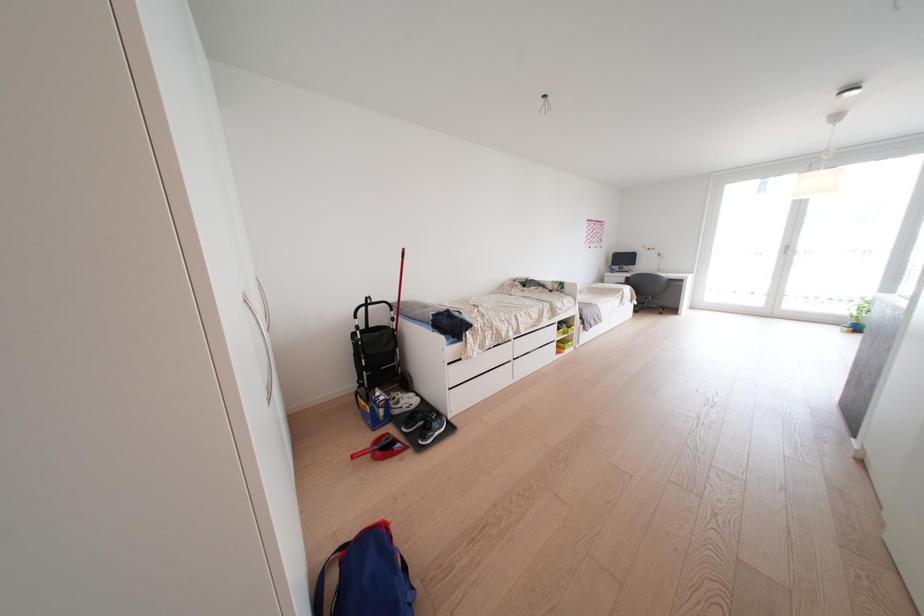
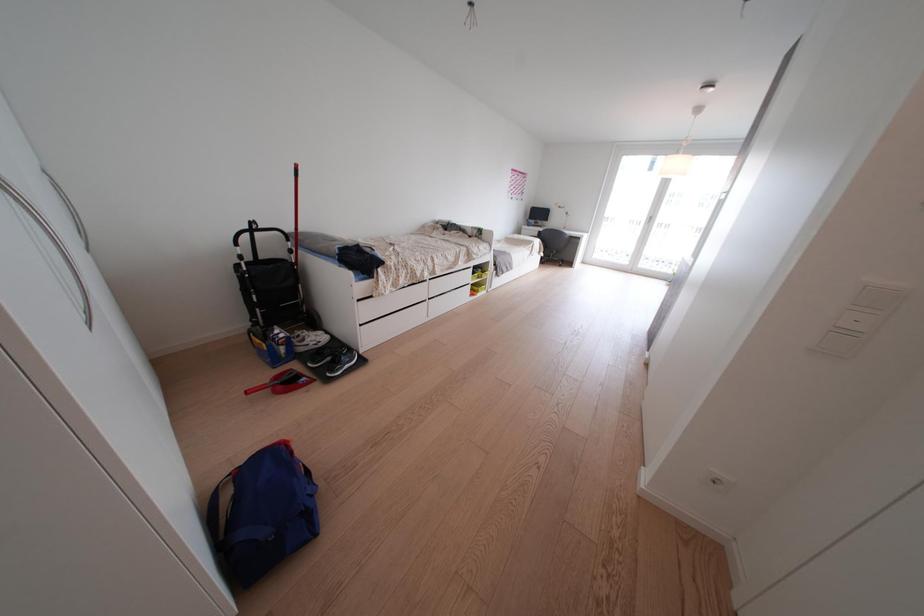
Question: The first image is from the beginning of the video and the second image is from the end. How did the camera likely rotate when shooting the video?

Choices:
 (A) Left
 (B) Right
 (C) Up
 (D) Down

Answer: (B)